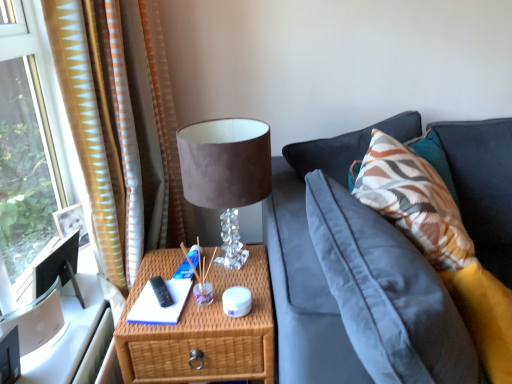
Image resolution: width=512 pixels, height=384 pixels. Find the location of `vacant space to the right of white paper at center`. vacant space to the right of white paper at center is located at coordinates (209, 296).